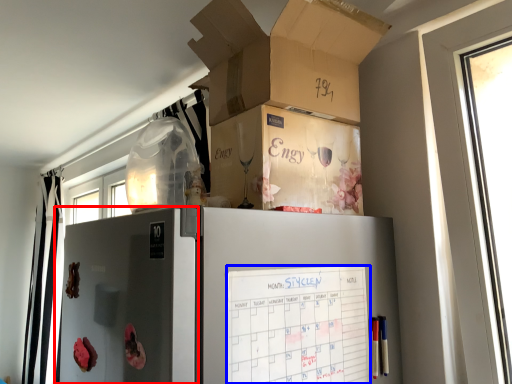
Question: Which point is closer to the camera, screen door (highlighted by a red box) or checklist (highlighted by a blue box)?

Choices:
 (A) screen door
 (B) checklist

Answer: (A)